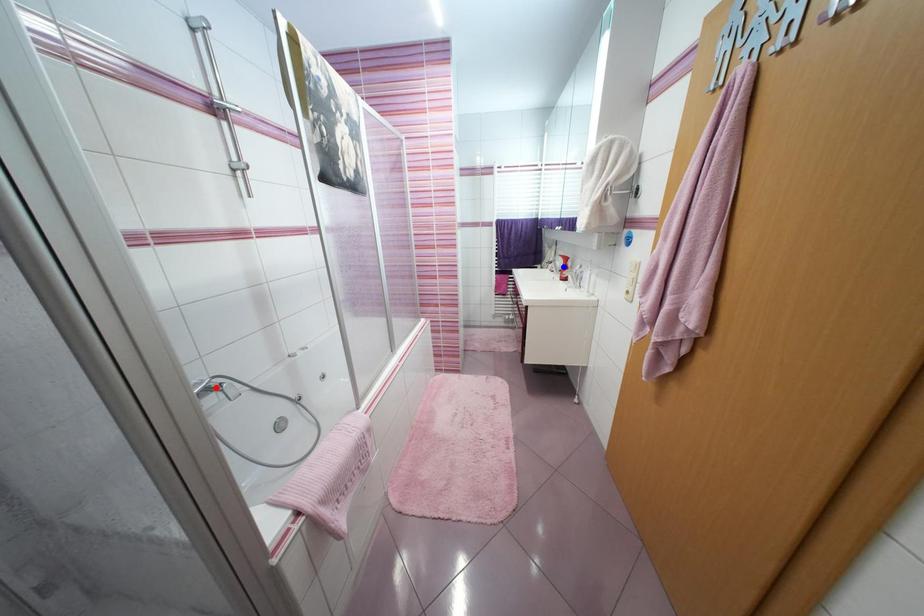
Question: Two points are marked on the image. Which point is closer to the camera?

Choices:
 (A) Blue point is closer.
 (B) Red point is closer.

Answer: (B)